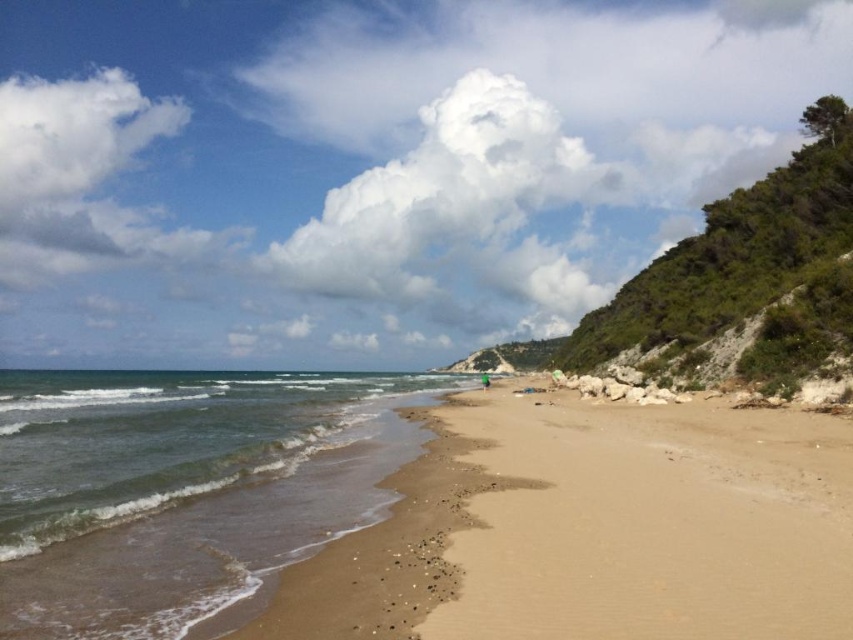
Question: Which object appears farthest from the camera in this image?

Choices:
 (A) light brown sand at center
 (B) green fabric person at center
 (C) greenish-blue water at lower left

Answer: (B)

Question: Does light brown sand at center have a greater width compared to green fabric person at center?

Choices:
 (A) no
 (B) yes

Answer: (B)

Question: Can you confirm if greenish-blue water at lower left is thinner than green fabric person at center?

Choices:
 (A) yes
 (B) no

Answer: (B)

Question: Which point is closer to the camera?

Choices:
 (A) (480, 376)
 (B) (236, 589)
 (C) (640, 561)

Answer: (B)

Question: Based on their relative distances, which object is nearer to the green fabric person at center?

Choices:
 (A) light brown sand at center
 (B) greenish-blue water at lower left

Answer: (B)

Question: Can you confirm if greenish-blue water at lower left is positioned below green fabric person at center?

Choices:
 (A) no
 (B) yes

Answer: (A)